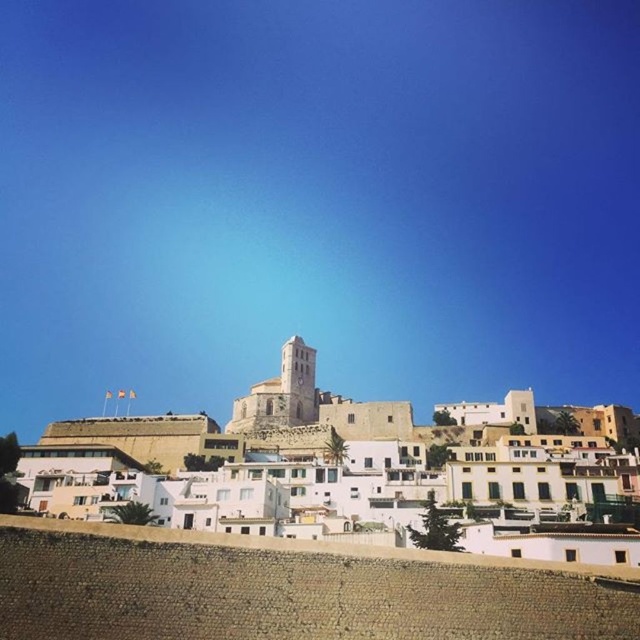
Question: Is brown cobblestone wall at lower center below white stucco buildings at center?

Choices:
 (A) yes
 (B) no

Answer: (B)

Question: Which object appears farthest from the camera in this image?

Choices:
 (A) white stone tower at center
 (B) brown cobblestone wall at lower center
 (C) white stucco buildings at center

Answer: (A)

Question: Based on their relative distances, which object is farther from the brown cobblestone wall at lower center?

Choices:
 (A) white stone tower at center
 (B) white stucco buildings at center

Answer: (A)

Question: Which object is positioned farthest from the white stone tower at center?

Choices:
 (A) white stucco buildings at center
 (B) brown cobblestone wall at lower center

Answer: (B)

Question: Is white stucco buildings at center to the right of white stone tower at center from the viewer's perspective?

Choices:
 (A) yes
 (B) no

Answer: (A)

Question: Can you confirm if brown cobblestone wall at lower center is wider than white stone tower at center?

Choices:
 (A) no
 (B) yes

Answer: (B)